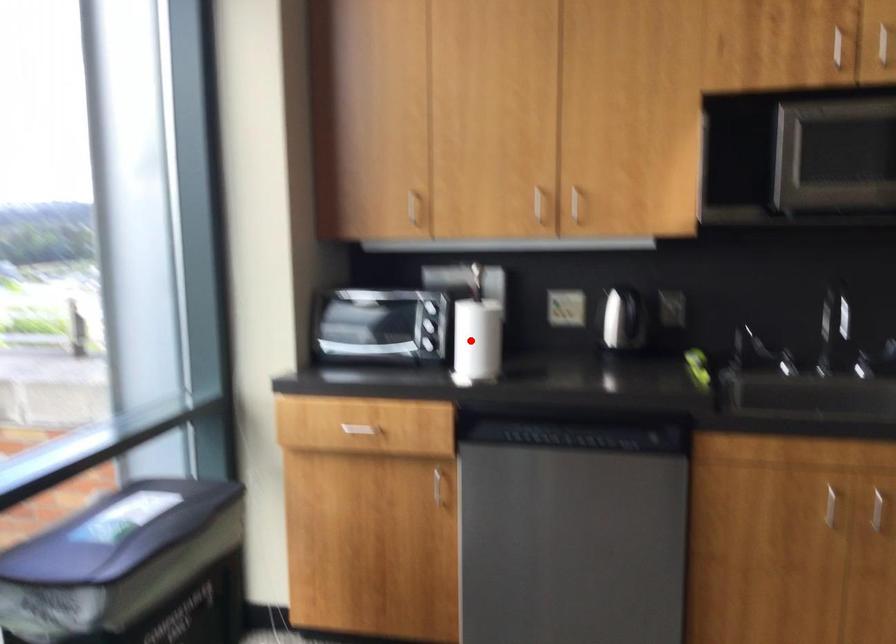
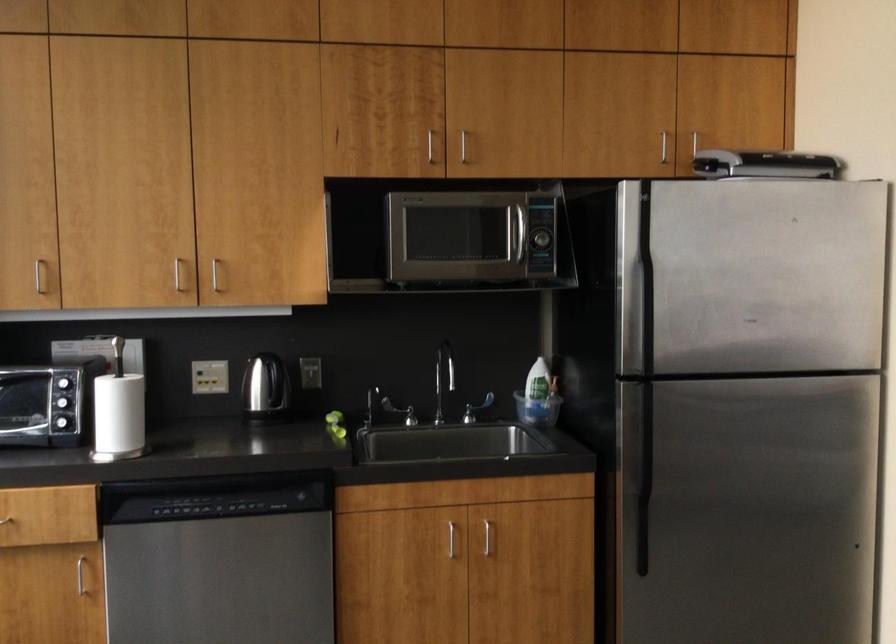
The point at the highlighted location is marked in the first image. Where is the corresponding point in the second image?

(117, 415)